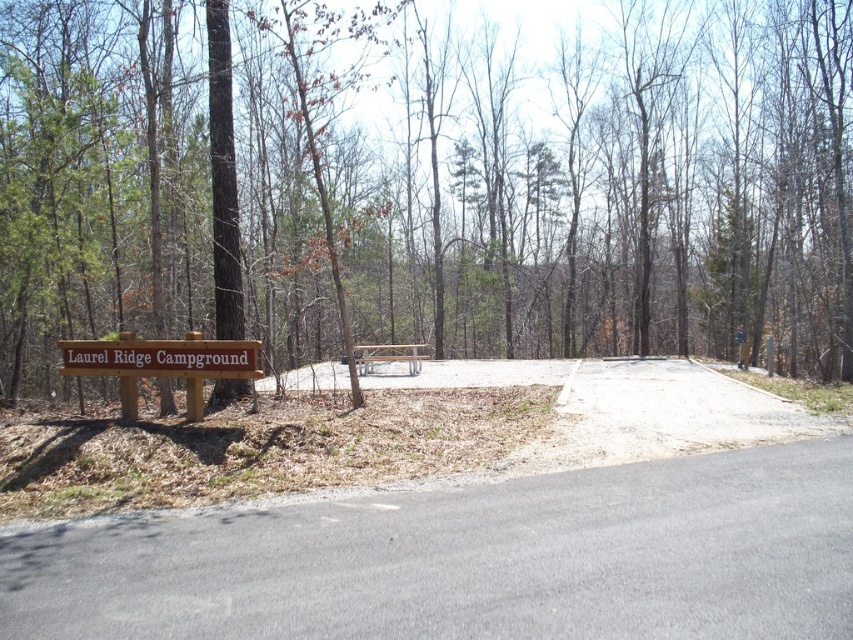
Question: Is brown wood sign at left below brown wooden sign at center?

Choices:
 (A) no
 (B) yes

Answer: (A)

Question: Does brown wood sign at left come in front of brown wooden bench at center?

Choices:
 (A) no
 (B) yes

Answer: (B)

Question: Based on their relative distances, which object is farther from the brown wooden sign at center?

Choices:
 (A) brown wooden sign at lower left
 (B) gray asphalt road at lower center
 (C) brown wood sign at left

Answer: (C)

Question: Which point appears closest to the camera in this image?

Choices:
 (A) (607, 536)
 (B) (73, 365)

Answer: (A)

Question: Considering the relative positions of gray asphalt road at lower center and brown wooden sign at lower left in the image provided, where is gray asphalt road at lower center located with respect to brown wooden sign at lower left?

Choices:
 (A) right
 (B) left

Answer: (A)

Question: Estimate the real-world distances between objects in this image. Which object is closer to the gray asphalt road at lower center?

Choices:
 (A) brown wooden sign at center
 (B) brown wooden sign at lower left
 (C) brown wooden bench at center
 (D) brown wood sign at left

Answer: (A)